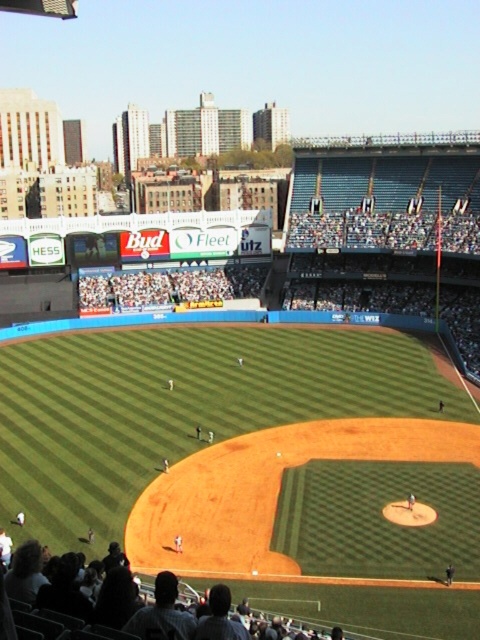
Question: Observing the image, what is the correct spatial positioning of green grass baseball field at center in reference to dark gray fabric seats at lower center?

Choices:
 (A) left
 (B) right

Answer: (A)

Question: Does green grass baseball field at center lie in front of dark gray fabric seats at lower center?

Choices:
 (A) no
 (B) yes

Answer: (A)

Question: Which point is farther to the camera?

Choices:
 (A) green grass baseball field at center
 (B) dark gray fabric seats at lower center

Answer: (A)

Question: Does green grass baseball field at center have a greater width compared to dark gray fabric seats at lower center?

Choices:
 (A) yes
 (B) no

Answer: (A)